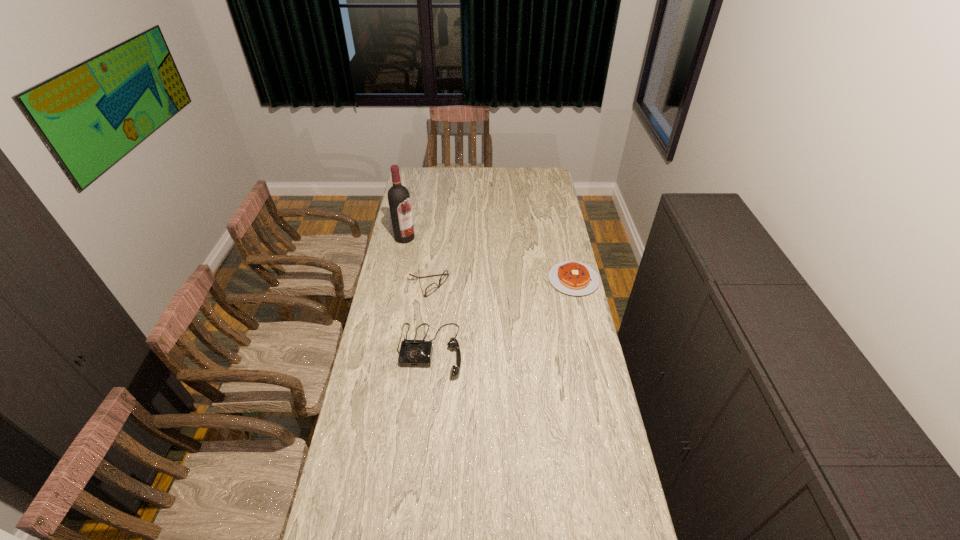
The width and height of the screenshot is (960, 540). What are the coordinates of `vacant region between the telephone and the wine bottle` in the screenshot? It's located at click(417, 294).

At what (x,y) coordinates should I click in order to perform the action: click on vacant region between the spectacles and the tallest object. Please return your answer as a coordinate pair (x, y). This screenshot has height=540, width=960. Looking at the image, I should click on (417, 261).

I want to click on empty location between the pancake and the nearest object, so click(501, 315).

Locate an element on the screen. free space that is in between the third shortest object and the wine bottle is located at coordinates (417, 294).

Locate which object is the second closest to the leftmost object. Please provide its 2D coordinates. Your answer should be formatted as a tuple, i.e. [(x, y)], where the tuple contains the x and y coordinates of a point satisfying the conditions above.

[(413, 353)]

Locate an element on the screen. object that is the closest to the pancake is located at coordinates (413, 353).

At what (x,y) coordinates should I click in order to perform the action: click on free spot that satisfies the following two spatial constraints: 1. on the back side of the pancake; 2. on the right side of the spectacles. Please return your answer as a coordinate pair (x, y). Image resolution: width=960 pixels, height=540 pixels. Looking at the image, I should click on (430, 280).

The image size is (960, 540). Identify the location of vacant space that satisfies the following two spatial constraints: 1. on the front side of the pancake; 2. on the left side of the farthest object. (396, 280).

Identify the location of vacant space that satisfies the following two spatial constraints: 1. on the front side of the tallest object; 2. on the right side of the spectacles. The height and width of the screenshot is (540, 960). (396, 284).